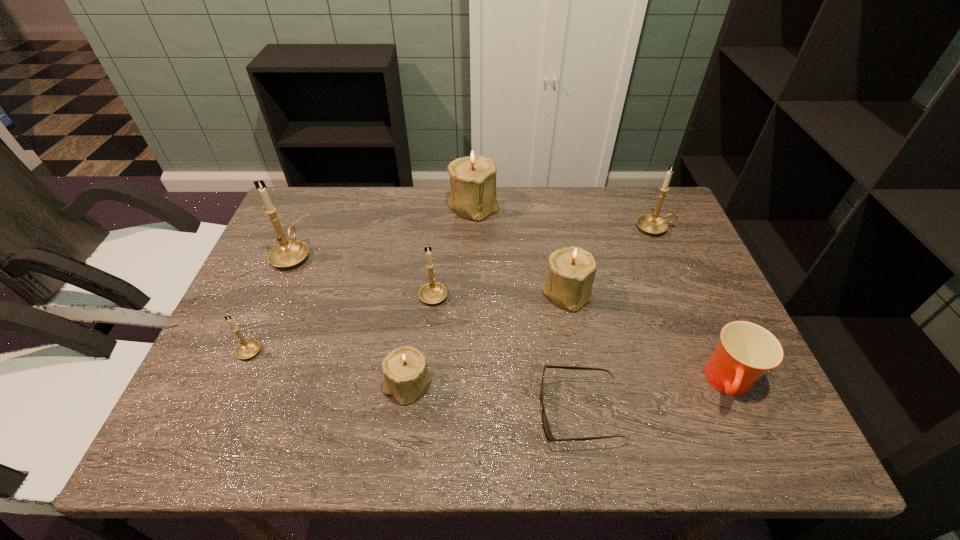
You are a GUI agent. You are given a task and a screenshot of the screen. Output one action in this format:
    pyautogui.click(x=<x>, y=<y>)
    Task: Click on the unoccupied position between the second nearest candle_holder and the nearest beige candle_holder
    Image resolution: width=960 pixels, height=540 pixels.
    Given the screenshot: What is the action you would take?
    (329, 367)

Find the location of `vacant area that lies between the nearest gold candle holder and the rightmost candle_holder`. vacant area that lies between the nearest gold candle holder and the rightmost candle_holder is located at coordinates (453, 288).

In order to click on free spot between the cup and the second gold candle holder from right to left in this screenshot , I will do `click(582, 339)`.

Image resolution: width=960 pixels, height=540 pixels. I want to click on free space between the sixth candle_holder from left to right and the nearest candle_holder, so click(487, 339).

Where is `the sixth closest object relative to the nearest candle_holder`? the sixth closest object relative to the nearest candle_holder is located at coordinates (473, 177).

Choose which object is the fourth nearest neighbor to the sixth farthest candle_holder. Please provide its 2D coordinates. Your answer should be formatted as a tuple, i.e. [(x, y)], where the tuple contains the x and y coordinates of a point satisfying the conditions above.

[(473, 177)]

Identify which candle_holder is the third closest to the shortest object. Please provide its 2D coordinates. Your answer should be formatted as a tuple, i.e. [(x, y)], where the tuple contains the x and y coordinates of a point satisfying the conditions above.

[(431, 293)]

Find the location of a particular element. The width and height of the screenshot is (960, 540). candle_holder that is the closest one to the cup is located at coordinates (571, 273).

The width and height of the screenshot is (960, 540). What are the coordinates of `gold candle holder object that ranks as the third closest to the second biggest gold candle holder` in the screenshot? It's located at (246, 349).

Identify the location of gold candle holder that is the closest one to the nearest gold candle holder. (288, 253).